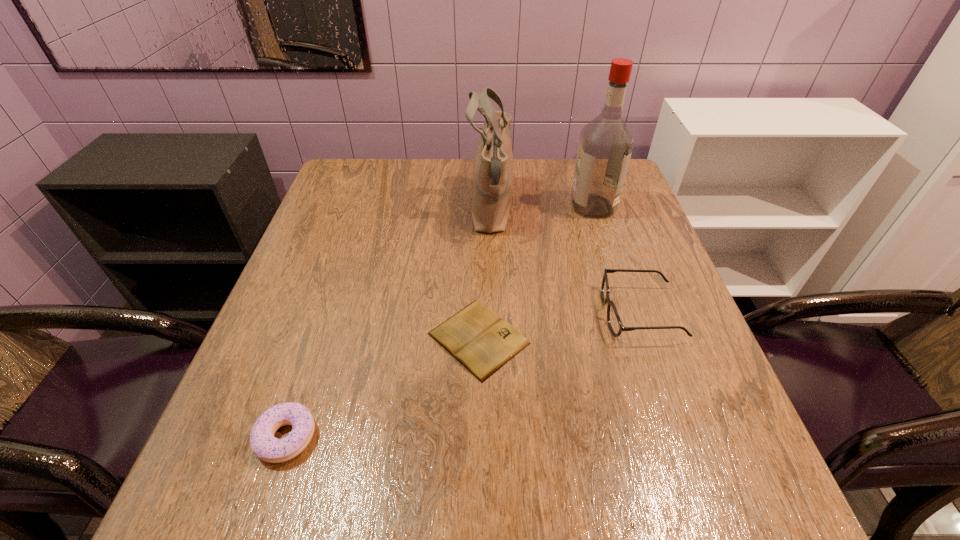
Where is `free region that satisfies the following two spatial constraints: 1. on the front-facing side of the tallest object; 2. on the front side of the book`? Image resolution: width=960 pixels, height=540 pixels. free region that satisfies the following two spatial constraints: 1. on the front-facing side of the tallest object; 2. on the front side of the book is located at coordinates (635, 339).

Where is `free space in the image that satisfies the following two spatial constraints: 1. on the front-facing side of the fourth shortest object; 2. on the front side of the second shortest object`? Image resolution: width=960 pixels, height=540 pixels. free space in the image that satisfies the following two spatial constraints: 1. on the front-facing side of the fourth shortest object; 2. on the front side of the second shortest object is located at coordinates tap(497, 437).

Find the location of a particular element. free space that satisfies the following two spatial constraints: 1. on the front-facing side of the tallest object; 2. on the front side of the shortest object is located at coordinates (635, 339).

Where is `free location that satisfies the following two spatial constraints: 1. on the front-facing side of the spectacles; 2. on the front side of the book`? The width and height of the screenshot is (960, 540). free location that satisfies the following two spatial constraints: 1. on the front-facing side of the spectacles; 2. on the front side of the book is located at coordinates (648, 339).